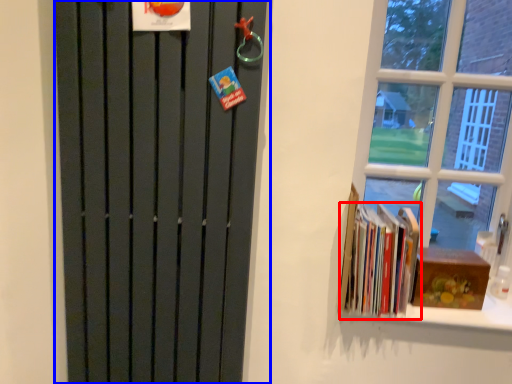
Question: Which point is closer to the camera, book (highlighted by a red box) or door (highlighted by a blue box)?

Choices:
 (A) book
 (B) door

Answer: (B)